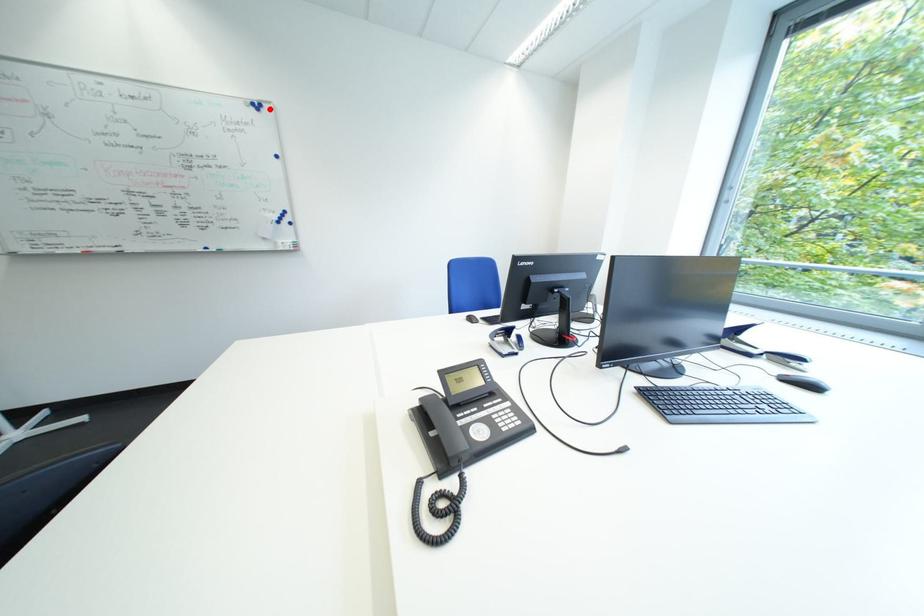
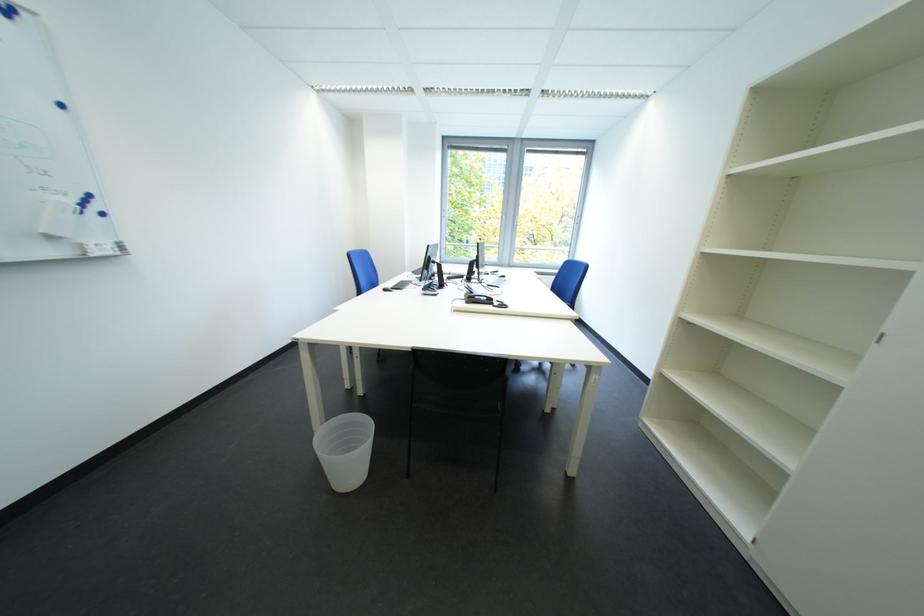
Where in the second image is the point corresponding to the highlighted location from the first image?

(17, 12)